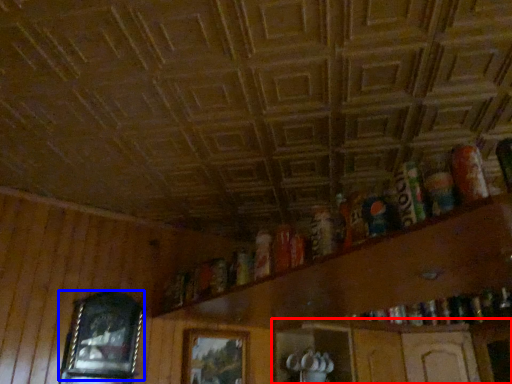
Question: Among these objects, which one is farthest to the camera, shelf (highlighted by a red box) or picture frame (highlighted by a blue box)?

Choices:
 (A) shelf
 (B) picture frame

Answer: (A)